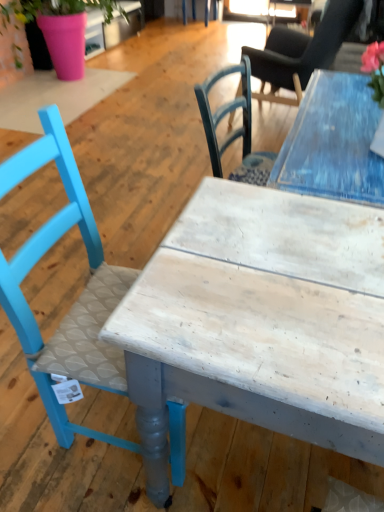
Question: Considering the relative positions of smooth black chair at upper right, the 1th chair in the right-to-left sequence, and pink matte pot at upper left in the image provided, is smooth black chair at upper right, the 1th chair in the right-to-left sequence, in front of pink matte pot at upper left?

Choices:
 (A) yes
 (B) no

Answer: (A)

Question: Does smooth black chair at upper right, acting as the first chair starting from the back, appear on the right side of pink matte pot at upper left?

Choices:
 (A) no
 (B) yes

Answer: (B)

Question: Considering the relative positions of smooth black chair at upper right, acting as the first chair starting from the back, and pink matte pot at upper left in the image provided, is smooth black chair at upper right, acting as the first chair starting from the back, to the left of pink matte pot at upper left from the viewer's perspective?

Choices:
 (A) yes
 (B) no

Answer: (B)

Question: Does smooth black chair at upper right, the 1th chair in the right-to-left sequence, have a greater width compared to pink matte pot at upper left?

Choices:
 (A) no
 (B) yes

Answer: (A)

Question: Is smooth black chair at upper right, the 1th chair when ordered from top to bottom, oriented towards pink matte pot at upper left?

Choices:
 (A) yes
 (B) no

Answer: (A)

Question: In the image, is pink matte pot at upper left positioned in front of or behind matte blue chair at left, placed as the first chair when sorted from front to back?

Choices:
 (A) behind
 (B) front

Answer: (A)

Question: Is point (79, 66) closer or farther from the camera than point (36, 162)?

Choices:
 (A) farther
 (B) closer

Answer: (A)

Question: Is pink matte pot at upper left wider or thinner than matte blue chair at left, which ranks as the first chair in left-to-right order?

Choices:
 (A) thin
 (B) wide

Answer: (B)

Question: From a real-world perspective, relative to matte blue chair at left, placed as the 2th chair when sorted from back to front, is pink matte pot at upper left vertically above or below?

Choices:
 (A) above
 (B) below

Answer: (B)

Question: Visually, is white wood table at center positioned to the left or to the right of pink matte pot at upper left?

Choices:
 (A) right
 (B) left

Answer: (A)

Question: Considering the positions of white wood table at center and pink matte pot at upper left in the image, is white wood table at center taller or shorter than pink matte pot at upper left?

Choices:
 (A) short
 (B) tall

Answer: (A)

Question: Is white wood table at center in front of or behind pink matte pot at upper left in the image?

Choices:
 (A) behind
 (B) front

Answer: (B)

Question: In terms of width, does white wood table at center look wider or thinner when compared to pink matte pot at upper left?

Choices:
 (A) thin
 (B) wide

Answer: (A)

Question: In terms of height, does smooth black chair at upper right, the 2th chair from the left, look taller or shorter compared to matte blue chair at left, which ranks as the first chair in left-to-right order?

Choices:
 (A) tall
 (B) short

Answer: (B)

Question: Is smooth black chair at upper right, the 2th chair from the left, spatially inside matte blue chair at left, the second chair in the top-to-bottom sequence, or outside of it?

Choices:
 (A) inside
 (B) outside

Answer: (B)